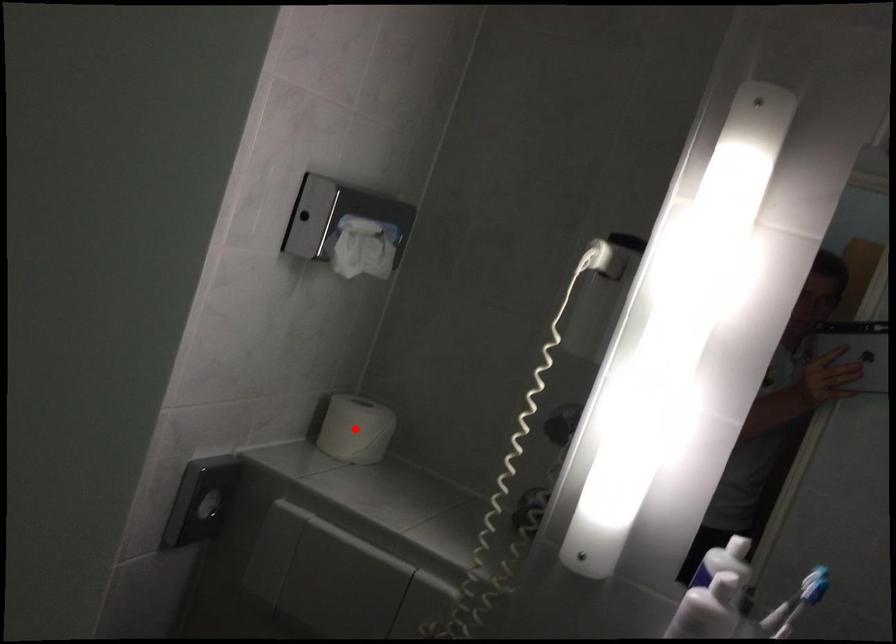
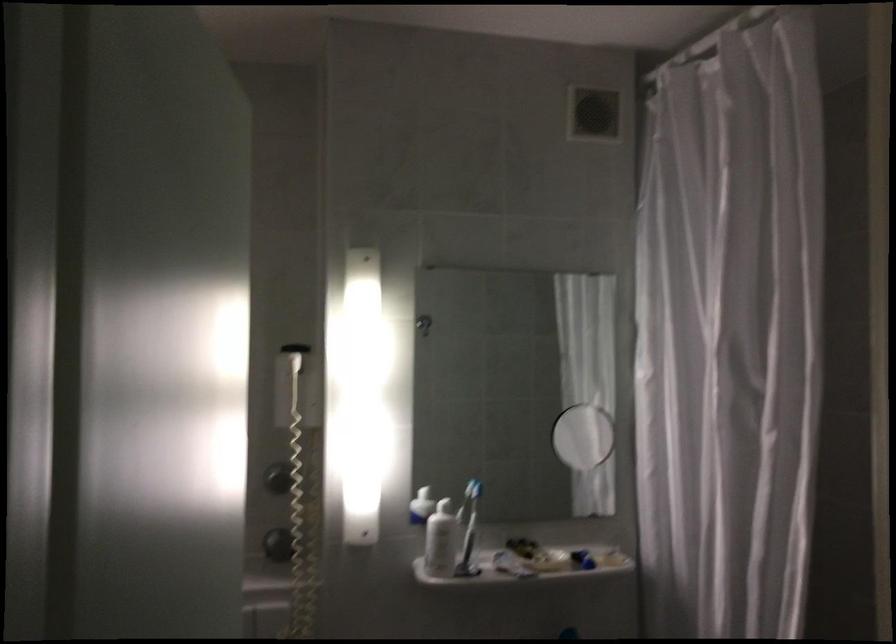
Question: I am providing you with two images of the same scene from different viewpoints. A red point is marked on the first image. Is the red point's position out of view in image 2?

Choices:
 (A) Yes
 (B) No

Answer: (A)